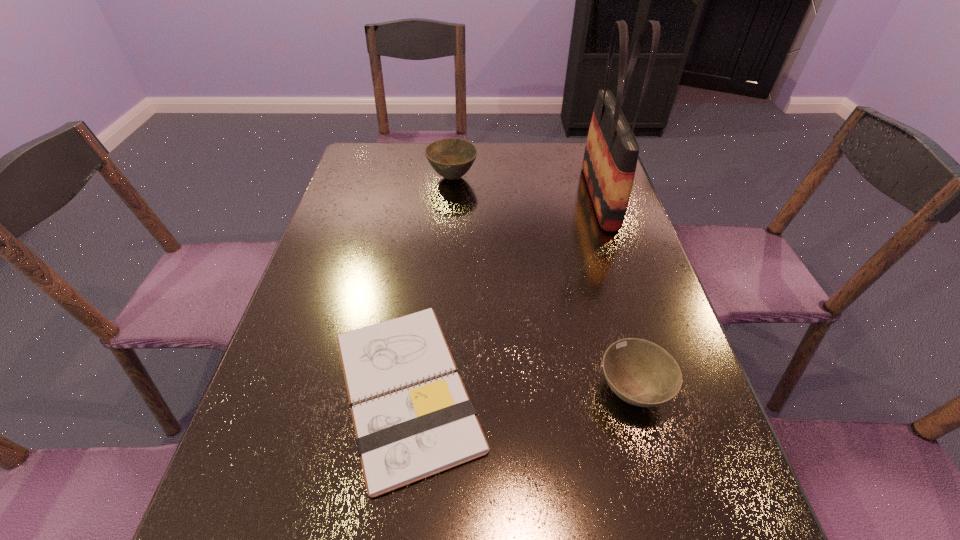
Locate an element on the screen. This screenshot has width=960, height=540. vacant space located on the front of the right bowl is located at coordinates (660, 492).

What are the coordinates of `free location located 0.070m on the back of the notepad` in the screenshot? It's located at (420, 291).

Identify the location of shopping bag at the far edge. (611, 153).

Image resolution: width=960 pixels, height=540 pixels. Find the location of `bowl located at the far edge`. bowl located at the far edge is located at coordinates (451, 158).

Find the location of `object that is at the left edge`. object that is at the left edge is located at coordinates (406, 436).

At what (x,y) coordinates should I click in order to perform the action: click on shopping bag at the right edge. Please return your answer as a coordinate pair (x, y). Looking at the image, I should click on (611, 153).

Identify the location of bowl positioned at the right edge. (641, 373).

I want to click on object at the far right corner, so click(x=611, y=153).

At what (x,y) coordinates should I click in order to perform the action: click on free space at the far edge. Please return your answer as a coordinate pair (x, y). Looking at the image, I should click on (527, 167).

In the image, there is a desktop. Identify the location of vacant space at the left edge. (363, 238).